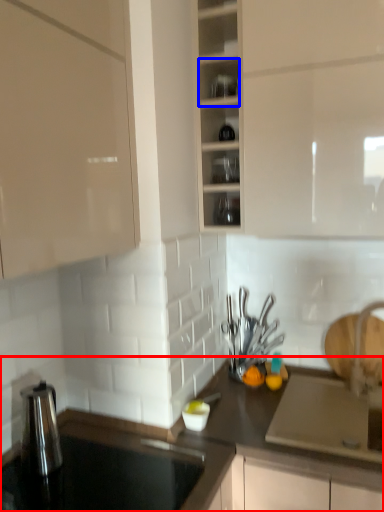
Question: Which of the following is the farthest to the observer, countertop (highlighted by a red box) or shelf (highlighted by a blue box)?

Choices:
 (A) countertop
 (B) shelf

Answer: (B)